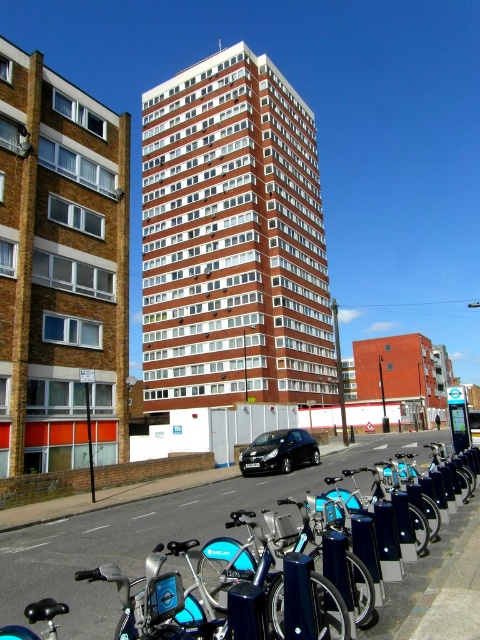
Question: Can you confirm if metallic gray bike rack at lower center is positioned above black metallic car at center?

Choices:
 (A) yes
 (B) no

Answer: (A)

Question: Which of the following is the closest to the observer?

Choices:
 (A) (63, 620)
 (B) (314, 456)

Answer: (A)

Question: Can you confirm if metallic gray bike rack at lower center is positioned above black metallic car at center?

Choices:
 (A) no
 (B) yes

Answer: (B)

Question: Is metallic gray bike rack at lower center closer to camera compared to black metallic car at center?

Choices:
 (A) no
 (B) yes

Answer: (B)